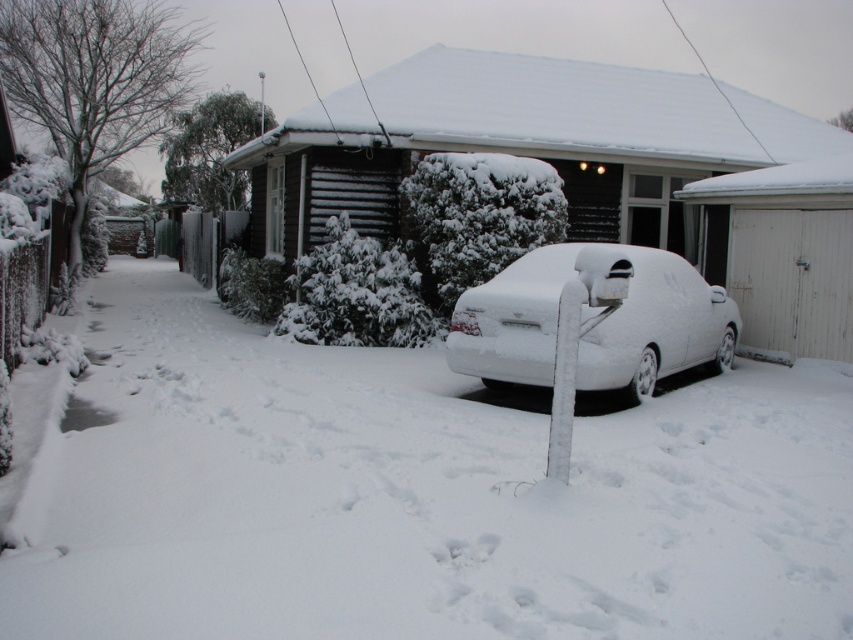
Question: Is white fluffy snow at center below white matte car at center?

Choices:
 (A) yes
 (B) no

Answer: (A)

Question: Observing the image, what is the correct spatial positioning of white matte car at center in reference to white frosted post at center?

Choices:
 (A) below
 (B) above

Answer: (B)

Question: Which point is closer to the camera taking this photo?

Choices:
 (A) (469, 333)
 (B) (94, 403)
 (C) (583, 284)

Answer: (C)

Question: Estimate the real-world distances between objects in this image. Which object is closer to the white fluffy snow at center?

Choices:
 (A) white matte car at center
 (B) white frosted post at center

Answer: (A)

Question: Among these points, which one is nearest to the camera?

Choices:
 (A) (625, 307)
 (B) (556, 385)
 (C) (230, 433)

Answer: (B)

Question: Does white fluffy snow at center appear over white matte car at center?

Choices:
 (A) yes
 (B) no

Answer: (B)